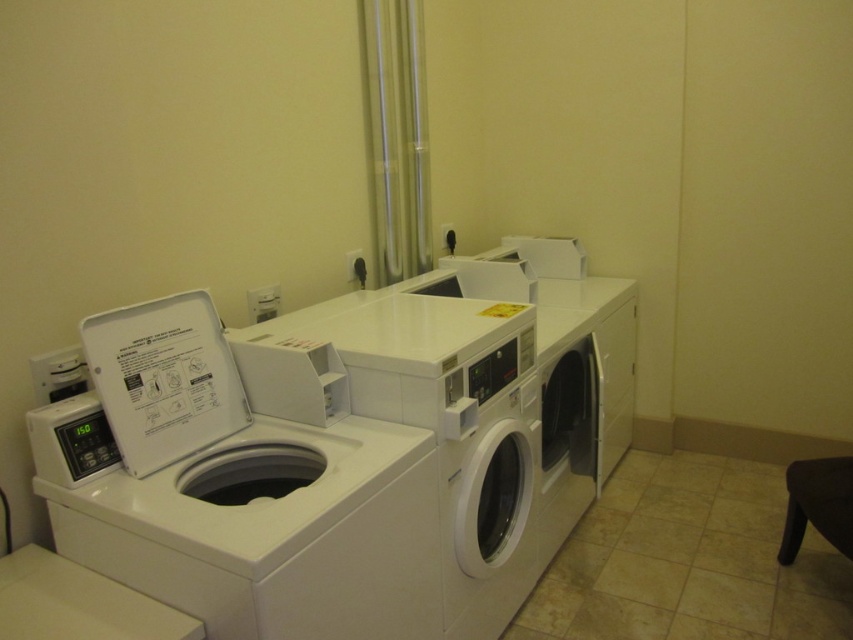
Can you confirm if white plastic washer at left is thinner than white matte washer at center?

Incorrect, white plastic washer at left's width is not less than white matte washer at center's.

Can you confirm if white plastic washer at left is smaller than white matte washer at center?

Indeed, white plastic washer at left has a smaller size compared to white matte washer at center.

Locate an element on the screen. This screenshot has height=640, width=853. white plastic washer at left is located at coordinates (239, 481).

I want to click on white plastic washer at left, so click(x=239, y=481).

Is white plastic washer at left thinner than black leather stool at lower right?

No.

Does point (320, 584) lie behind point (813, 460)?

No, (320, 584) is closer to viewer.

Does point (357, 532) come farther from viewer compared to point (834, 483)?

No, it is not.

In order to click on white plastic washer at left in this screenshot , I will do `click(239, 481)`.

Can you confirm if white matte washer at center is wider than black leather stool at lower right?

Correct, the width of white matte washer at center exceeds that of black leather stool at lower right.

Which is below, white matte washer at center or black leather stool at lower right?

Positioned lower is black leather stool at lower right.

The height and width of the screenshot is (640, 853). What do you see at coordinates (410, 465) in the screenshot?
I see `white matte washer at center` at bounding box center [410, 465].

At what (x,y) coordinates should I click in order to perform the action: click on white matte washer at center. Please return your answer as a coordinate pair (x, y). This screenshot has height=640, width=853. Looking at the image, I should click on (410, 465).